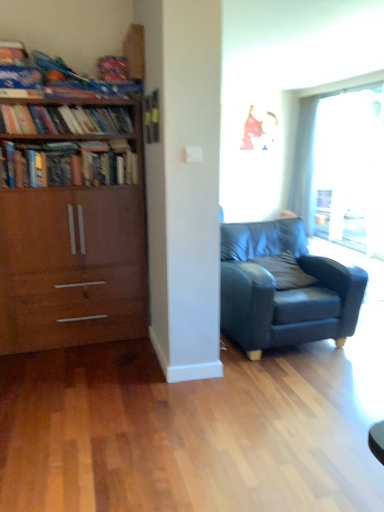
What do you see at coordinates (284, 288) in the screenshot? This screenshot has height=512, width=384. I see `matte black armchair at center` at bounding box center [284, 288].

Locate an element on the screen. The image size is (384, 512). white sheer curtain at upper right is located at coordinates (303, 162).

The height and width of the screenshot is (512, 384). What are the coordinates of `wooden bookcase at left` in the screenshot? It's located at (72, 221).

What do you see at coordinates (66, 165) in the screenshot?
I see `hardcover books at left, the first book when ordered from bottom to top` at bounding box center [66, 165].

Where is `gray fabric pillow at center`? gray fabric pillow at center is located at coordinates (285, 271).

From the image's perspective, is white sheer curtain at upper right positioned above or below wooden bookcase at left?

Based on their image positions, white sheer curtain at upper right is located above wooden bookcase at left.

How many degrees apart are the facing directions of white sheer curtain at upper right and wooden bookcase at left?

85.2 degrees.

Is point (309, 109) positioned after point (44, 309)?

Yes, it is.

Looking at this image, from their relative heights in the image, would you say gray fabric pillow at center is taller or shorter than matte black armchair at center?

gray fabric pillow at center is shorter than matte black armchair at center.

Locate an element on the screen. This screenshot has height=512, width=384. chair to the left of gray fabric pillow at center is located at coordinates (284, 288).

From the picture: Is gray fabric pillow at center facing towards matte black armchair at center?

Yes, gray fabric pillow at center is oriented towards matte black armchair at center.

From the image's perspective, is gray fabric pillow at center located above or below matte black armchair at center?

gray fabric pillow at center is situated higher than matte black armchair at center in the image.

Which object is more forward, wooden bookcase at left or transparent glass window at upper right?

Positioned in front is wooden bookcase at left.

Considering the positions of objects wooden bookcase at left and transparent glass window at upper right in the image provided, who is more to the right, wooden bookcase at left or transparent glass window at upper right?

transparent glass window at upper right is more to the right.

From the image's perspective, is wooden bookcase at left positioned above or below transparent glass window at upper right?

Clearly, from the image's perspective, wooden bookcase at left is below transparent glass window at upper right.

Which is nearer, (307,150) or (2,109)?

Point (2,109)

Can wooden bookshelf at left, the second book from the bottom, be found inside transparent glass window at upper right?

No, wooden bookshelf at left, the second book from the bottom, is not surrounded by transparent glass window at upper right.

From a real-world perspective, does transparent glass window at upper right sit lower than wooden bookshelf at left, the second book from the bottom?

Correct, in the physical world, transparent glass window at upper right is lower than wooden bookshelf at left, the second book from the bottom.

In terms of size, does transparent glass window at upper right appear bigger or smaller than wooden bookshelf at left, the first book from the top?

Clearly, transparent glass window at upper right is larger in size than wooden bookshelf at left, the first book from the top.

Is hardcover books at left, which appears as the second book when viewed from the top, located within gray fabric pillow at center?

Actually, hardcover books at left, which appears as the second book when viewed from the top, is outside gray fabric pillow at center.

From the image's perspective, is gray fabric pillow at center located above hardcover books at left, the first book when ordered from bottom to top?

No.

From the picture: Is gray fabric pillow at center shorter than hardcover books at left, which appears as the second book when viewed from the top?

Correct, gray fabric pillow at center is not as tall as hardcover books at left, which appears as the second book when viewed from the top.

Considering the sizes of wooden bookshelf at left, the first book from the top, and transparent glass window at upper right in the image, is wooden bookshelf at left, the first book from the top, wider or thinner than transparent glass window at upper right?

In the image, wooden bookshelf at left, the first book from the top, appears to be wider than transparent glass window at upper right.

From the picture: From the image's perspective, is wooden bookshelf at left, the first book from the top, located beneath transparent glass window at upper right?

Correct, wooden bookshelf at left, the first book from the top, appears lower than transparent glass window at upper right in the image.

Based on the photo, how many degrees apart are the facing directions of wooden bookshelf at left, the first book from the top, and transparent glass window at upper right?

The facing directions of wooden bookshelf at left, the first book from the top, and transparent glass window at upper right are 89.9 degrees apart.

Is point (14, 115) more distant than point (310, 128)?

No, it is not.

Locate an element on the screen. This screenshot has height=512, width=384. window behind the hardcover books at left, the first book when ordered from bottom to top is located at coordinates (312, 138).

Is hardcover books at left, which appears as the second book when viewed from the top, to the left of transparent glass window at upper right from the viewer's perspective?

Indeed, hardcover books at left, which appears as the second book when viewed from the top, is positioned on the left side of transparent glass window at upper right.

Is hardcover books at left, the first book when ordered from bottom to top, far from transparent glass window at upper right?

Yes, hardcover books at left, the first book when ordered from bottom to top, is far from transparent glass window at upper right.

Looking at this image, from the image's perspective, does hardcover books at left, which appears as the second book when viewed from the top, appear lower than transparent glass window at upper right?

Indeed, from the image's perspective, hardcover books at left, which appears as the second book when viewed from the top, is shown beneath transparent glass window at upper right.

I want to click on bookcase lying below the white sheer curtain at upper right (from the image's perspective), so click(x=72, y=221).

I want to click on chair located in front of the gray fabric pillow at center, so click(284, 288).

When comparing their distances from hardcover books at left, the first book when ordered from bottom to top, does white sheer curtain at upper right or transparent glass window at upper right seem closer?

transparent glass window at upper right.

Considering their positions, is wooden bookshelf at left, the second book from the bottom, positioned closer to transparent glass window at upper right than hardcover books at left, which appears as the second book when viewed from the top?

wooden bookshelf at left, the second book from the bottom, is positioned closer to the anchor transparent glass window at upper right.

Looking at the image, which one is located further to transparent glass window at upper right, wooden bookcase at left or hardcover books at left, the first book when ordered from bottom to top?

Based on the image, wooden bookcase at left appears to be further to transparent glass window at upper right.

Considering their positions, is white sheer curtain at upper right positioned closer to wooden bookcase at left than transparent glass window at upper right?

transparent glass window at upper right is closer to wooden bookcase at left.

From the image, which object appears to be farther from white sheer curtain at upper right, hardcover books at left, which appears as the second book when viewed from the top, or transparent glass window at upper right?

Based on the image, hardcover books at left, which appears as the second book when viewed from the top, appears to be further to white sheer curtain at upper right.

Which object lies nearer to the anchor point gray fabric pillow at center, wooden bookcase at left or hardcover books at left, which appears as the second book when viewed from the top?

Based on the image, wooden bookcase at left appears to be nearer to gray fabric pillow at center.

Based on their spatial positions, is transparent glass window at upper right or hardcover books at left, which appears as the second book when viewed from the top, further from white sheer curtain at upper right?

Among the two, hardcover books at left, which appears as the second book when viewed from the top, is located further to white sheer curtain at upper right.

From the image, which object appears to be farther from matte black armchair at center, white sheer curtain at upper right or wooden bookshelf at left, the first book from the top?

white sheer curtain at upper right is further to matte black armchair at center.

This screenshot has width=384, height=512. What are the coordinates of `pillow between hardcover books at left, the first book when ordered from bottom to top, and white sheer curtain at upper right in the front-back direction` in the screenshot? It's located at (285, 271).

The height and width of the screenshot is (512, 384). In order to click on window between gray fabric pillow at center and white sheer curtain at upper right in the front-back direction in this screenshot , I will do `click(312, 138)`.

Image resolution: width=384 pixels, height=512 pixels. I want to click on pillow between matte black armchair at center and white sheer curtain at upper right in the front-back direction, so click(285, 271).

Identify the location of window located between hardcover books at left, the first book when ordered from bottom to top, and white sheer curtain at upper right in the depth direction. (312, 138).